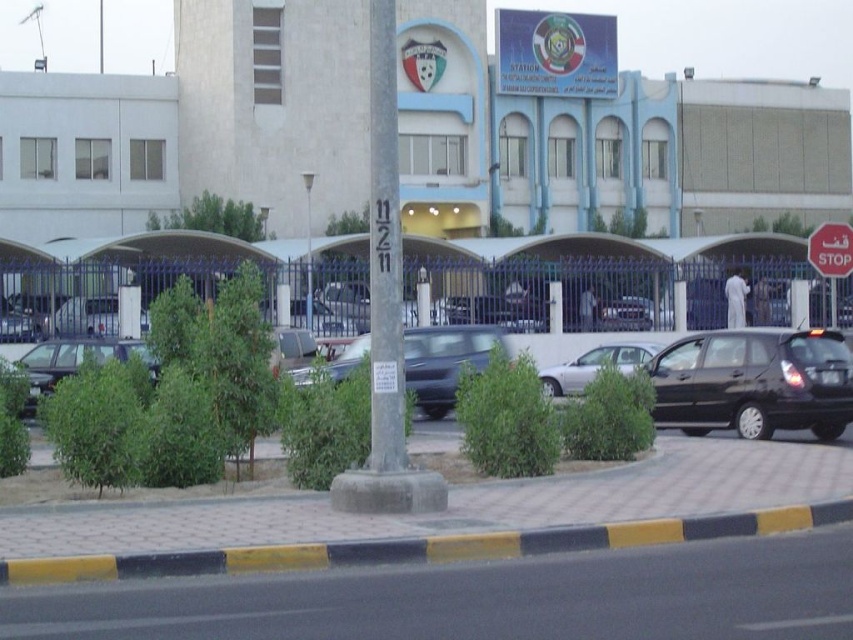
Who is more forward, (x=392, y=308) or (x=33, y=387)?

Point (x=392, y=308) is more forward.

Which is below, gray concrete pole at center or matte black car at lower left?

matte black car at lower left is below.

Who is more distant from viewer, (x=374, y=65) or (x=18, y=358)?

The point (x=18, y=358) is behind.

Identify the location of gray concrete pole at center. (384, 252).

Consider the image. Which is more to the right, white concrete building at center or gray concrete pole at center?

gray concrete pole at center is more to the right.

What do you see at coordinates (608, 144) in the screenshot? Image resolution: width=853 pixels, height=640 pixels. I see `white concrete building at center` at bounding box center [608, 144].

Find the location of a particular element. This screenshot has height=640, width=853. white concrete building at center is located at coordinates (608, 144).

Between gray concrete pole at center and red matte stop sign at upper right, which one has more height?

gray concrete pole at center

Does point (370, 131) come farther from viewer compared to point (833, 230)?

No, (370, 131) is closer to viewer.

Which is in front, point (370, 435) or point (815, 230)?

Point (370, 435) is in front.

Find the location of a particular element. The width and height of the screenshot is (853, 640). gray concrete pole at center is located at coordinates (384, 252).